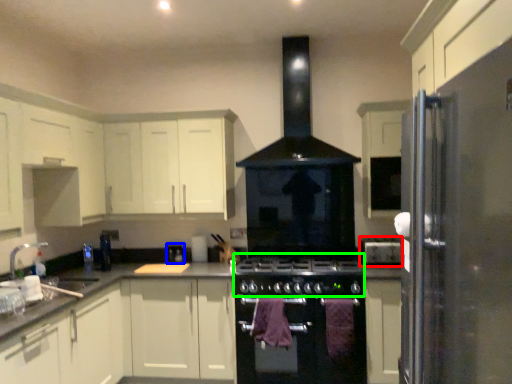
Question: Based on their relative distances, which object is farther from appliance (highlighted by a red box)? Choose from appliance (highlighted by a blue box) and gas stove (highlighted by a green box).

Choices:
 (A) appliance
 (B) gas stove

Answer: (A)